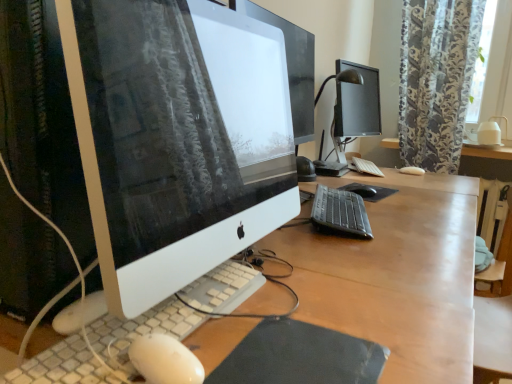
Locate an element on the screen. Image resolution: width=512 pixels, height=384 pixels. unoccupied region to the right of black matte mousepad at lower center, the 1th mousepad in the front-to-back sequence is located at coordinates pos(412,344).